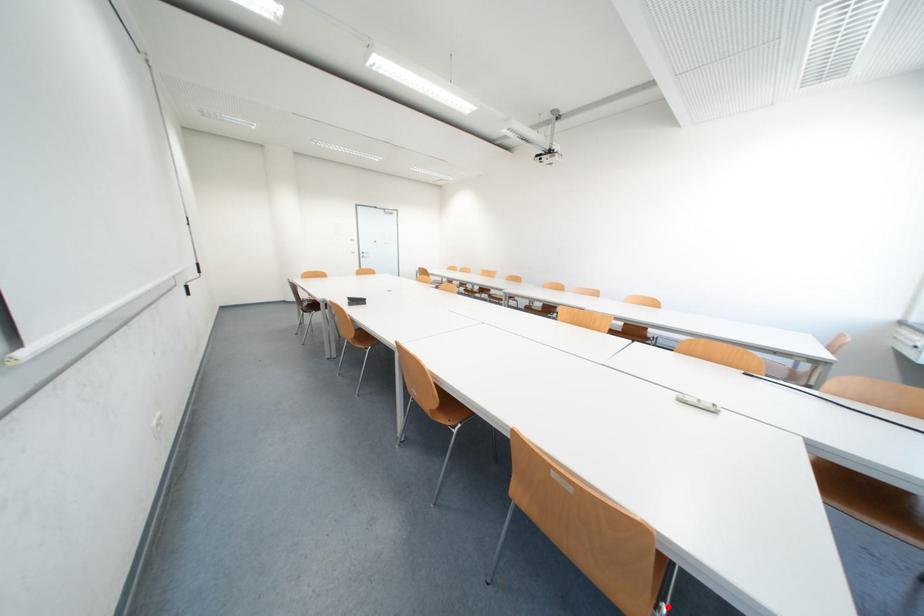
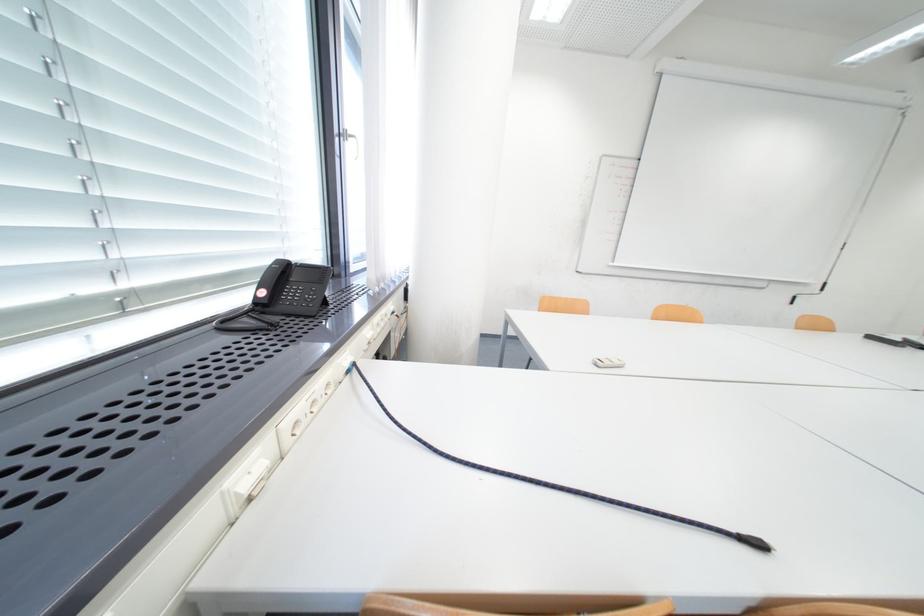
Question: I am providing you with two images of the same scene from different viewpoints. A red point is marked on the first image. At the location where the point appears in image 1, is it still visible in image 2?

Choices:
 (A) Yes
 (B) No

Answer: (B)